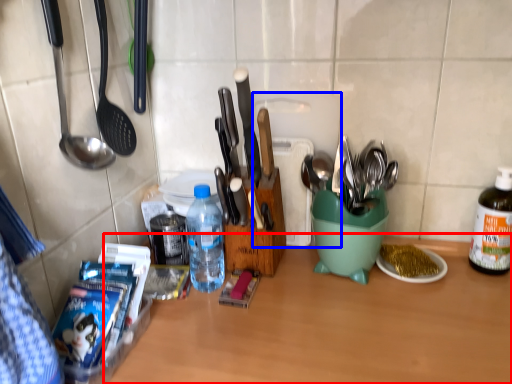
Question: Which point is closer to the camera, table (highlighted by a red box) or cutting board (highlighted by a blue box)?

Choices:
 (A) table
 (B) cutting board

Answer: (A)